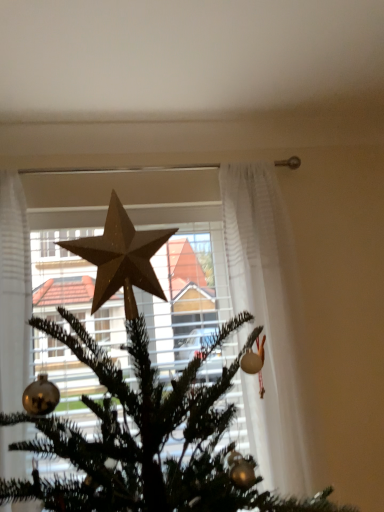
This screenshot has width=384, height=512. Describe the element at coordinates (146, 435) in the screenshot. I see `gold metallic christmas tree at center` at that location.

What are the coordinates of `gold metallic christmas tree at center` in the screenshot? It's located at (146, 435).

Identify the location of gold metallic christmas tree at center. (146, 435).